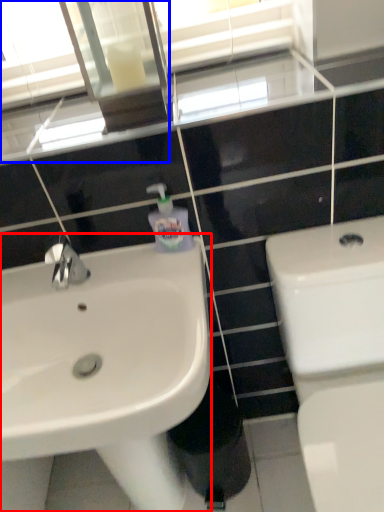
Question: Which of the following is the closest to the observer, sink (highlighted by a red box) or mirror (highlighted by a blue box)?

Choices:
 (A) sink
 (B) mirror

Answer: (A)